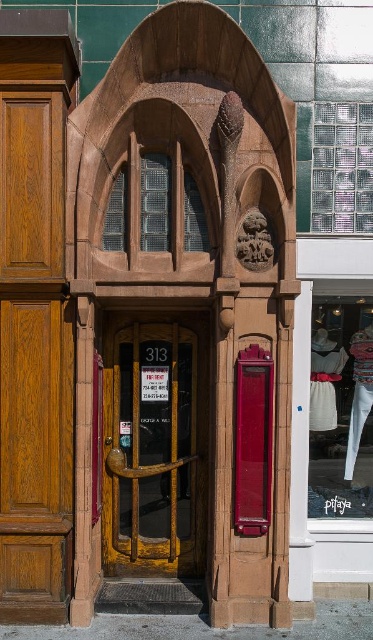
Is matte oak door at left to the right of shiny red phone box at center from the viewer's perspective?

Incorrect, matte oak door at left is not on the right side of shiny red phone box at center.

The height and width of the screenshot is (640, 373). I want to click on matte oak door at left, so click(x=33, y=358).

The height and width of the screenshot is (640, 373). I want to click on matte oak door at left, so click(33, 358).

Is white fabric at lower right thinner than shiny red phone box at center?

No, white fabric at lower right is not thinner than shiny red phone box at center.

Measure the distance between white fabric at lower right and camera.

A distance of 6.73 meters exists between white fabric at lower right and camera.

Image resolution: width=373 pixels, height=640 pixels. I want to click on white fabric at lower right, so click(340, 408).

Can you confirm if matte oak door at left is shorter than yellow matte door at center?

In fact, matte oak door at left may be taller than yellow matte door at center.

Does matte oak door at left have a greater width compared to yellow matte door at center?

In fact, matte oak door at left might be narrower than yellow matte door at center.

At what (x,y) coordinates should I click in order to perform the action: click on matte oak door at left. Please return your answer as a coordinate pair (x, y). The image size is (373, 640). Looking at the image, I should click on point(33,358).